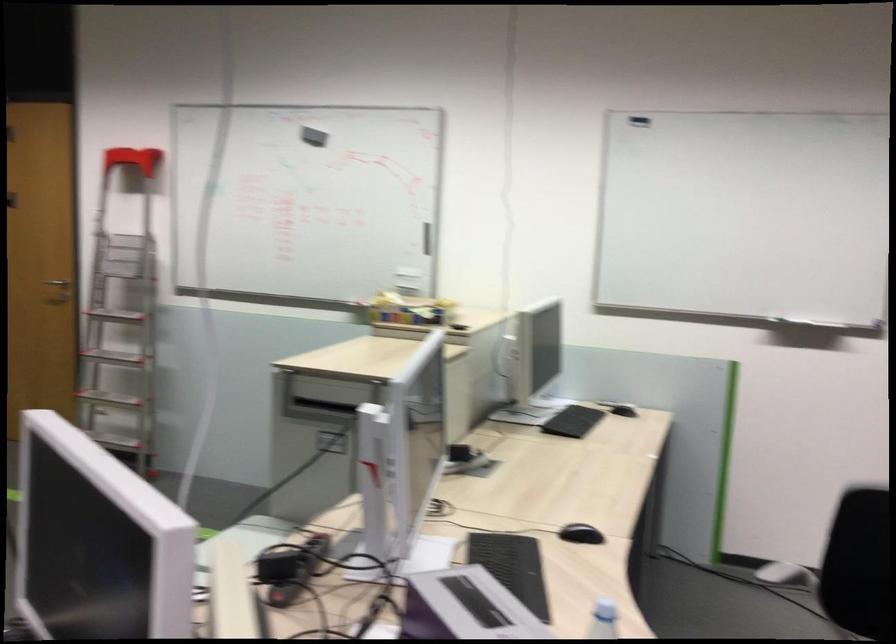
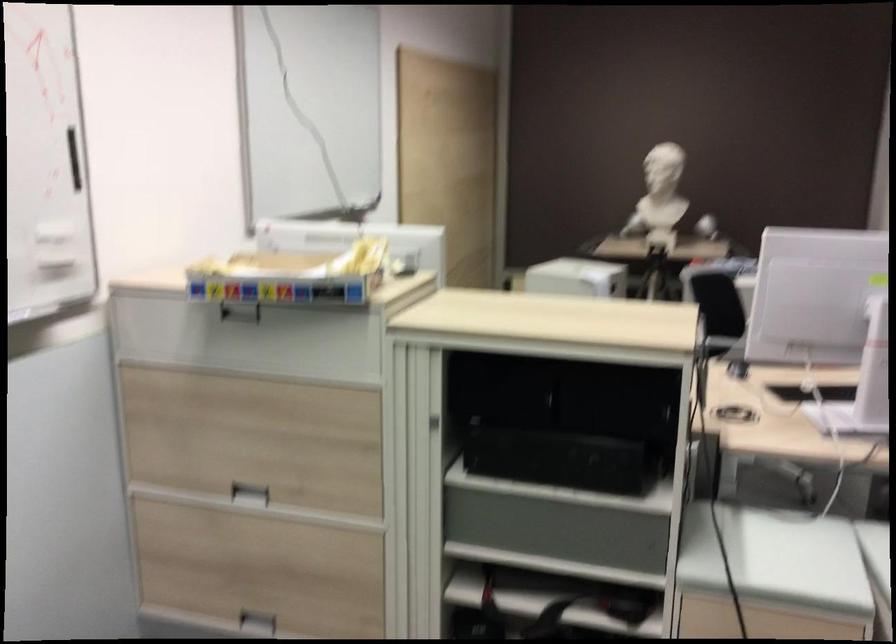
In the second image, find the point that corresponds to (x=299, y=437) in the first image.

(597, 459)